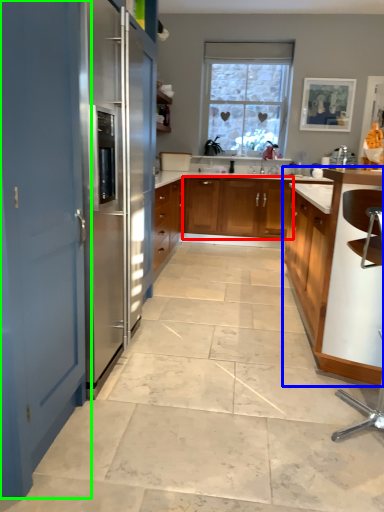
Question: Estimate the real-world distances between objects in this image. Which object is farther from cabinetry (highlighted by a red box), cabinetry (highlighted by a blue box) or door (highlighted by a green box)?

Choices:
 (A) cabinetry
 (B) door

Answer: (B)